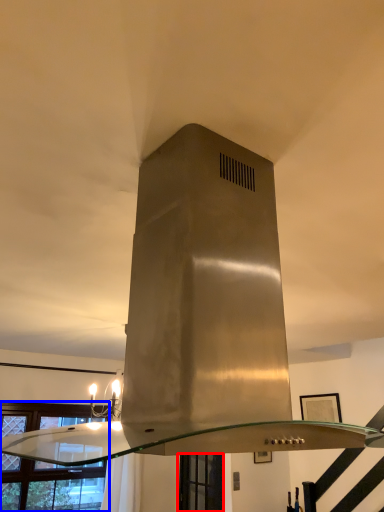
Question: Among these objects, which one is farthest to the camera, window (highlighted by a red box) or window (highlighted by a blue box)?

Choices:
 (A) window
 (B) window

Answer: (A)